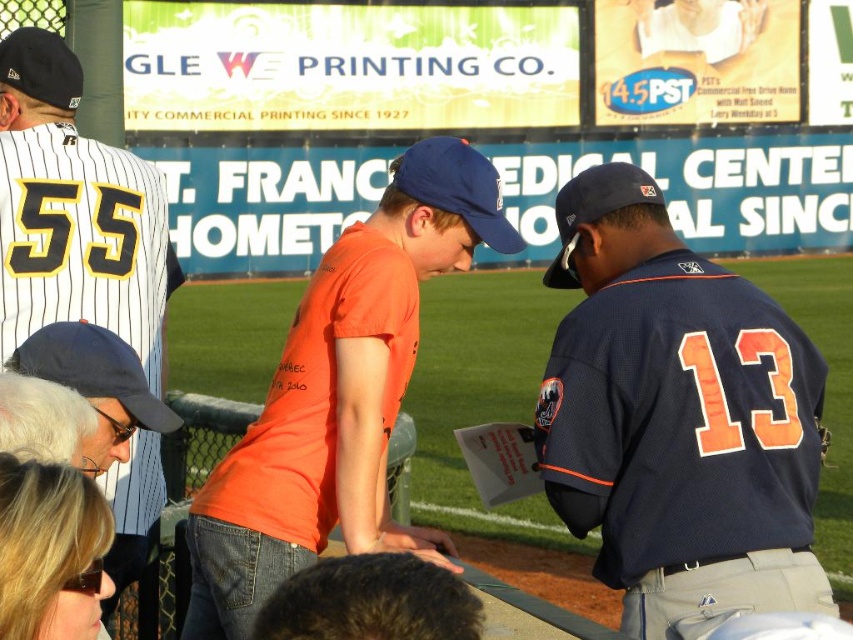
Is white pinstriped jersey at left thinner than blue fabric baseball cap at center?

Yes.

The image size is (853, 640). Find the location of `white pinstriped jersey at left`. white pinstriped jersey at left is located at coordinates (74, 212).

The image size is (853, 640). Identify the location of white pinstriped jersey at left. (74, 212).

In the scene shown: Does blue fabric baseball cap at lower left have a larger size compared to blue fabric baseball cap at center?

Actually, blue fabric baseball cap at lower left might be smaller than blue fabric baseball cap at center.

Does point (119, 400) lie behind point (431, 186)?

No.

What do you see at coordinates (93, 369) in the screenshot?
I see `blue fabric baseball cap at lower left` at bounding box center [93, 369].

Where is `blue fabric baseball cap at lower left`? blue fabric baseball cap at lower left is located at coordinates (93, 369).

Between navy blue jersey at center and navy blue baseball cap at center, which one has less height?

navy blue jersey at center is shorter.

Is point (543, 412) positioned before point (637, 188)?

Yes, point (543, 412) is closer to viewer.

In order to click on navy blue jersey at center in this screenshot , I will do `click(677, 417)`.